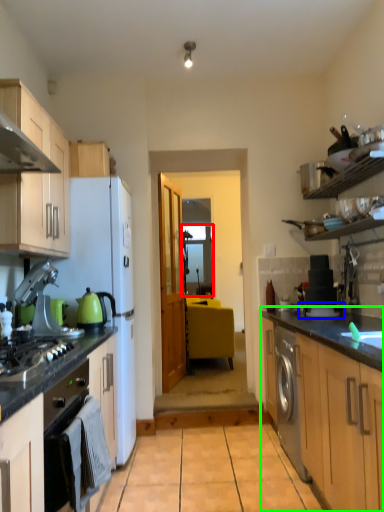
Question: Based on their relative distances, which object is nearer to glass door (highlighted by a red box)? Choose from appliance (highlighted by a blue box) and counter (highlighted by a green box).

Choices:
 (A) appliance
 (B) counter

Answer: (A)